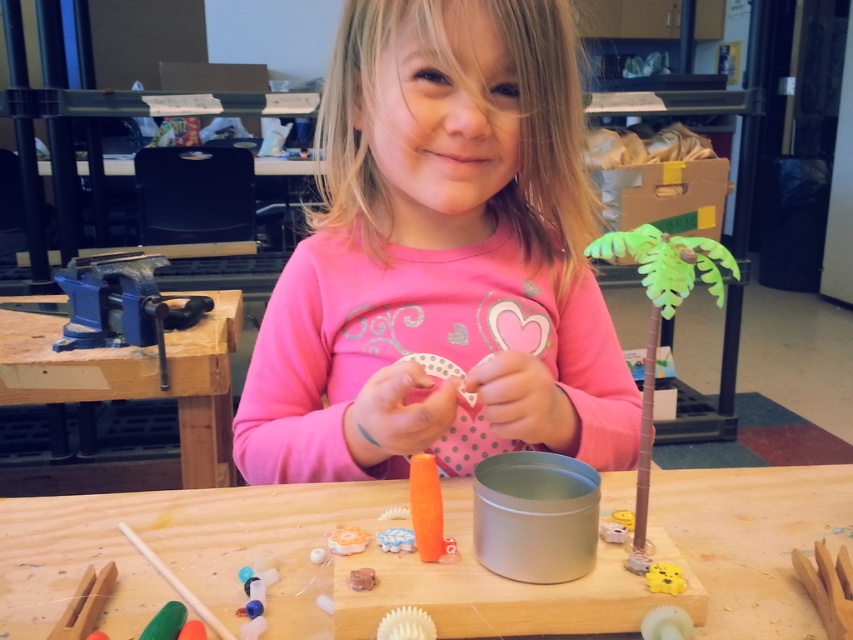
Question: Estimate the real-world distances between objects in this image. Which object is farther from the wooden stick at lower left?

Choices:
 (A) blue wood table at left
 (B) wooden table at center

Answer: (A)

Question: Does pink matte shirt at center come behind blue wood table at left?

Choices:
 (A) yes
 (B) no

Answer: (B)

Question: Is blue metal vise at left thinner than yellow matte toy at lower right?

Choices:
 (A) yes
 (B) no

Answer: (B)

Question: Which point appears closest to the camera in this image?

Choices:
 (A) (231, 342)
 (B) (676, 579)
 (C) (399, 540)

Answer: (B)

Question: Which point is farther to the camera?

Choices:
 (A) blue wood table at left
 (B) blue metal vise at left

Answer: (A)

Question: Observing the image, what is the correct spatial positioning of green matte plant at right in reference to matte orange glue stick at center?

Choices:
 (A) below
 (B) above

Answer: (B)